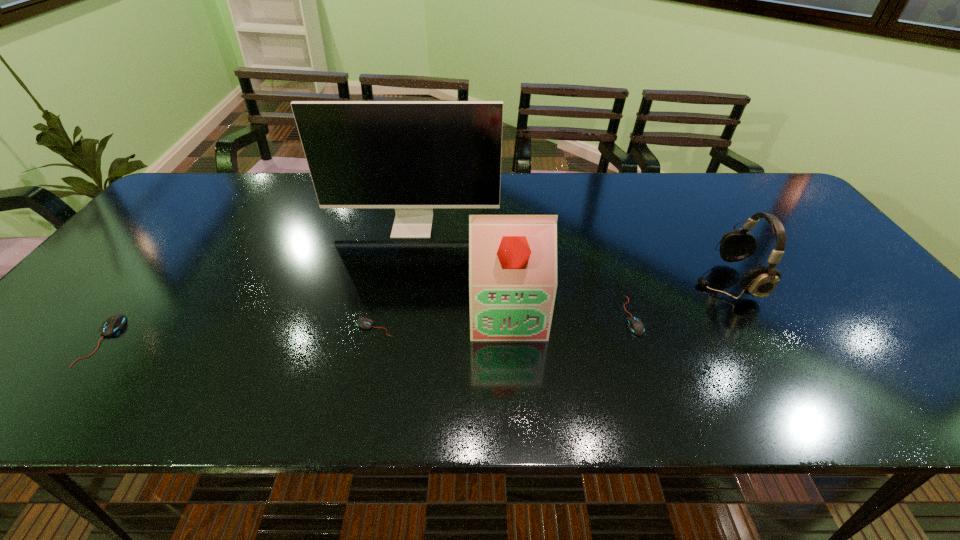
What are the coordinates of `vacant point located between the rightmost object and the second tallest mouse` in the screenshot? It's located at (679, 298).

I want to click on vacant point located between the soya milk and the leftmost object, so click(x=305, y=326).

The image size is (960, 540). I want to click on free space between the leftmost mouse and the shortest mouse, so click(x=238, y=334).

You are a GUI agent. You are given a task and a screenshot of the screen. Output one action in this format:
    pyautogui.click(x=<x>, y=<y>)
    Task: Click on the free spot between the leftmost mouse and the third tallest object
    
    Given the screenshot: What is the action you would take?
    pyautogui.click(x=414, y=310)

Locate which object is the fourth closest to the second object from right to left. Please provide its 2D coordinates. Your answer should be formatted as a tuple, i.e. [(x, y)], where the tuple contains the x and y coordinates of a point satisfying the conditions above.

[(364, 323)]

Where is `object that can be found as the closest to the shortest mouse`? object that can be found as the closest to the shortest mouse is located at coordinates (512, 257).

Select which mouse is the second closest to the leftmost mouse. Please provide its 2D coordinates. Your answer should be formatted as a tuple, i.e. [(x, y)], where the tuple contains the x and y coordinates of a point satisfying the conditions above.

[(635, 325)]

Where is `mouse object that ranks as the closest to the second shortest object`? The image size is (960, 540). mouse object that ranks as the closest to the second shortest object is located at coordinates (364, 323).

Locate an element on the screen. vacant space that satisfies the following two spatial constraints: 1. with the microphone on the side of the rightmost object; 2. with the cap open on the soya milk is located at coordinates [745, 312].

This screenshot has width=960, height=540. In order to click on free location that satisfies the following two spatial constraints: 1. with the microphone on the side of the third tallest object; 2. on the front side of the shortest mouse in this screenshot , I will do `click(754, 328)`.